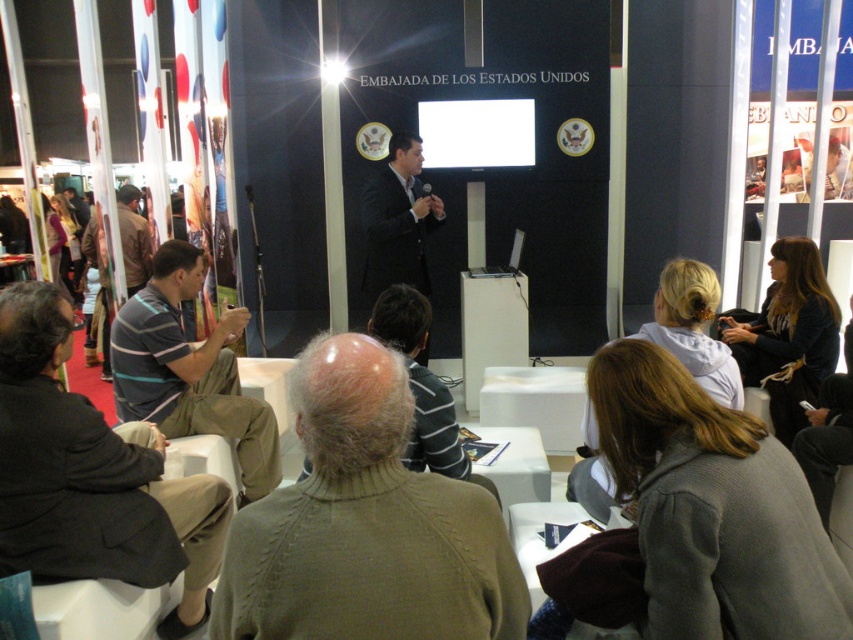
Question: Is dark brown hair at right wider than light brown hair at center?

Choices:
 (A) yes
 (B) no

Answer: (A)

Question: Which of the following is the closest to the observer?

Choices:
 (A) (763, 470)
 (B) (595, 428)

Answer: (A)

Question: Can you confirm if knitted green sweater at center is smaller than striped cotton shirt at lower left?

Choices:
 (A) no
 (B) yes

Answer: (B)

Question: Which point is closer to the camera taking this photo?

Choices:
 (A) (331, 374)
 (B) (169, 262)
 (C) (438, 204)
 (D) (785, 392)

Answer: (A)

Question: Which of these objects is positioned closest to the knitted green sweater at center?

Choices:
 (A) dark suit at center
 (B) striped cotton shirt at lower left
 (C) dark brown hair at right

Answer: (B)

Question: Where is knitted green sweater at center located in relation to striped cotton shirt at left in the image?

Choices:
 (A) left
 (B) right

Answer: (B)